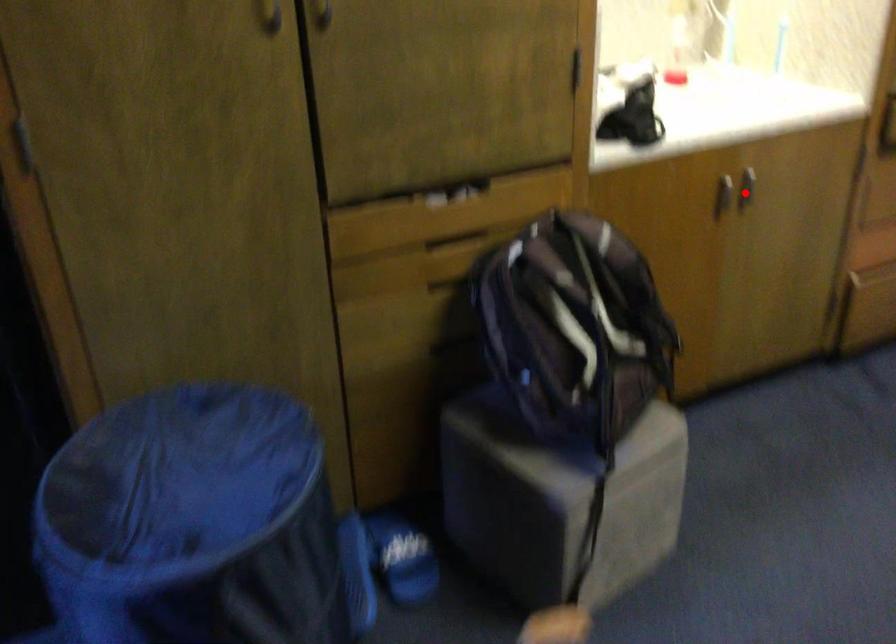
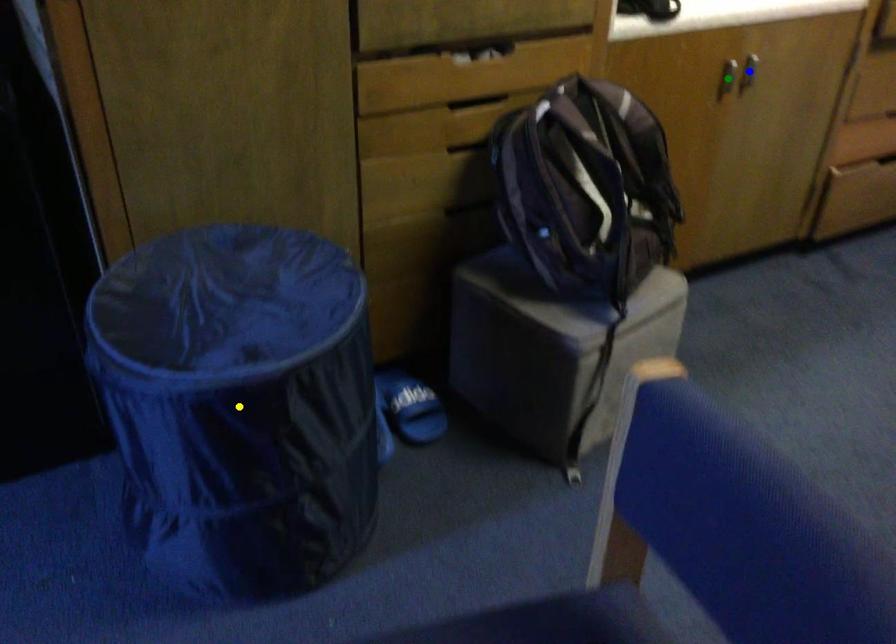
Question: I am providing you with two images of the same scene from different viewpoints. A red point is marked on the first image. You are given multiple points on the second image. In image 2, which mark is for the same physical point as the one in image 1?

Choices:
 (A) green point
 (B) blue point
 (C) yellow point

Answer: (B)